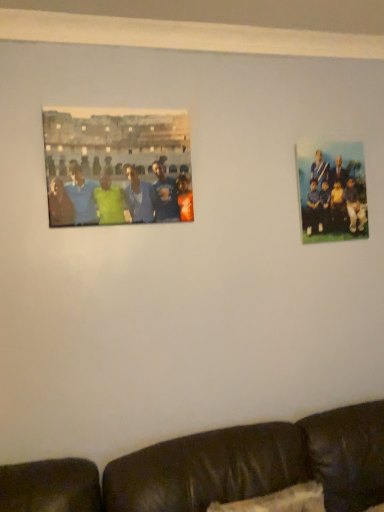
Question: Is formal attire group at upper right bigger or smaller than matte plastic photo at upper left?

Choices:
 (A) big
 (B) small

Answer: (B)

Question: In the image, is formal attire group at upper right positioned in front of or behind matte plastic photo at upper left?

Choices:
 (A) behind
 (B) front

Answer: (A)

Question: From a real-world perspective, relative to matte plastic photo at upper left, is formal attire group at upper right vertically above or below?

Choices:
 (A) below
 (B) above

Answer: (A)

Question: Considering the positions of matte plastic photo at upper left and formal attire group at upper right in the image, is matte plastic photo at upper left bigger or smaller than formal attire group at upper right?

Choices:
 (A) big
 (B) small

Answer: (A)

Question: Is point (135, 129) closer or farther from the camera than point (344, 200)?

Choices:
 (A) closer
 (B) farther

Answer: (A)

Question: Is matte plastic photo at upper left wider or thinner than formal attire group at upper right?

Choices:
 (A) wide
 (B) thin

Answer: (A)

Question: Relative to formal attire group at upper right, is matte plastic photo at upper left in front or behind?

Choices:
 (A) behind
 (B) front

Answer: (B)